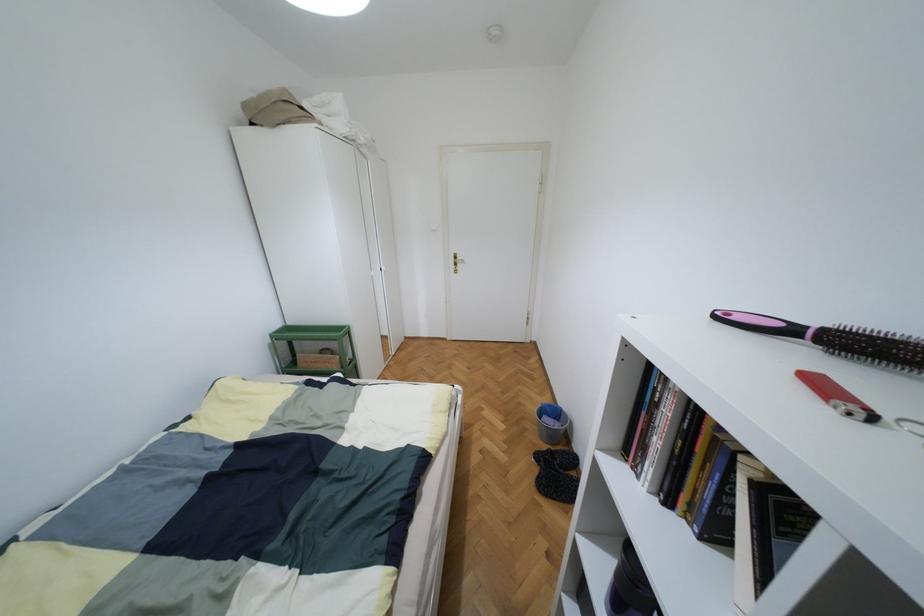
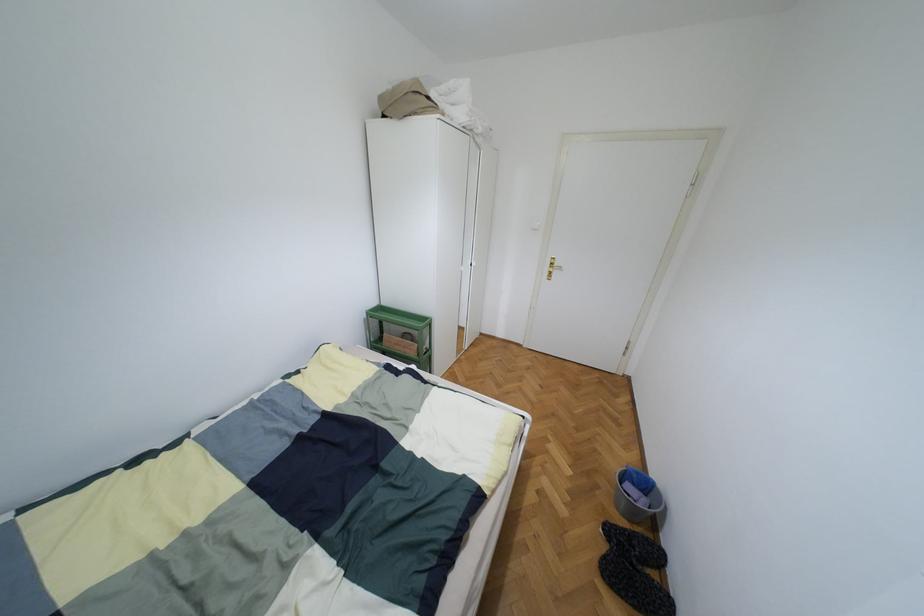
Locate, in the second image, the point that corresponds to point (533, 454) in the first image.

(603, 524)